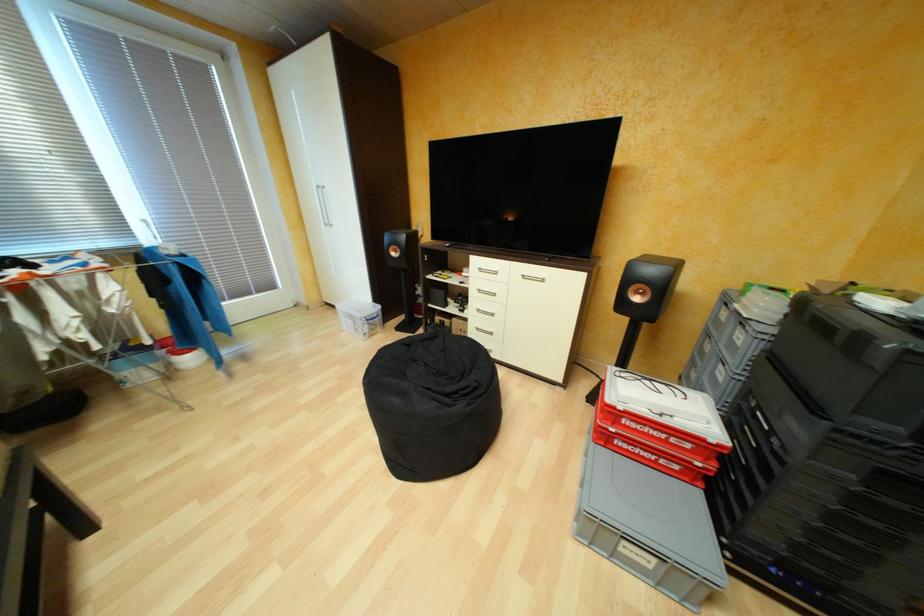
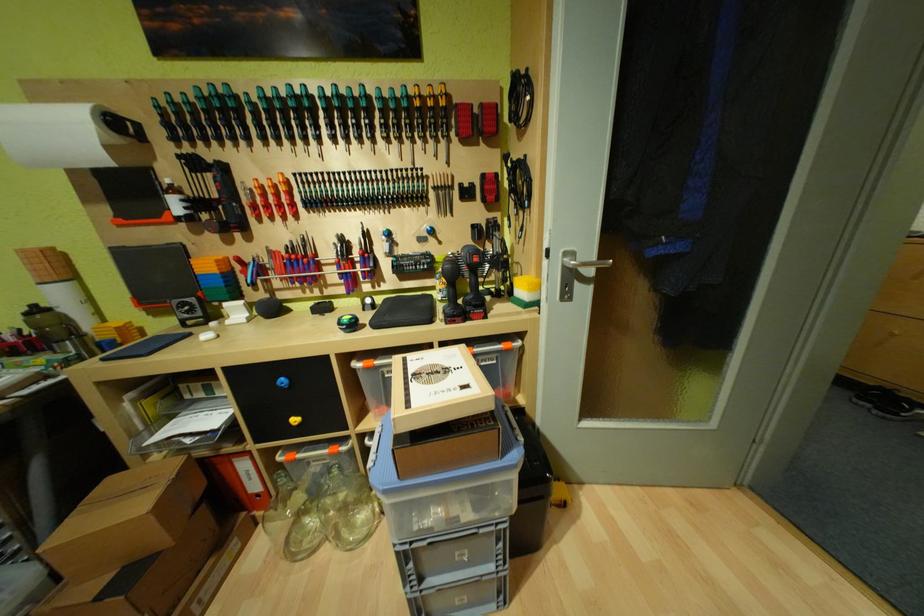
Question: I am providing you with two images of the same scene from different viewpoints. Which of the following objects are not visible in image2?

Choices:
 (A) paper towel roll
 (B) white wardrobe handle
 (C) green spray can
 (D) silver door handle

Answer: (B)